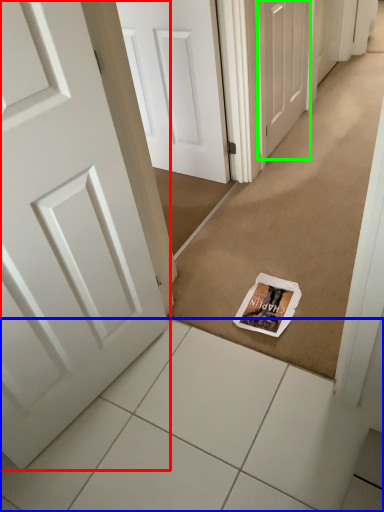
Question: Which object is positioned closest to door (highlighted by a red box)? Select from tile (highlighted by a blue box) and door (highlighted by a green box).

Choices:
 (A) tile
 (B) door

Answer: (A)